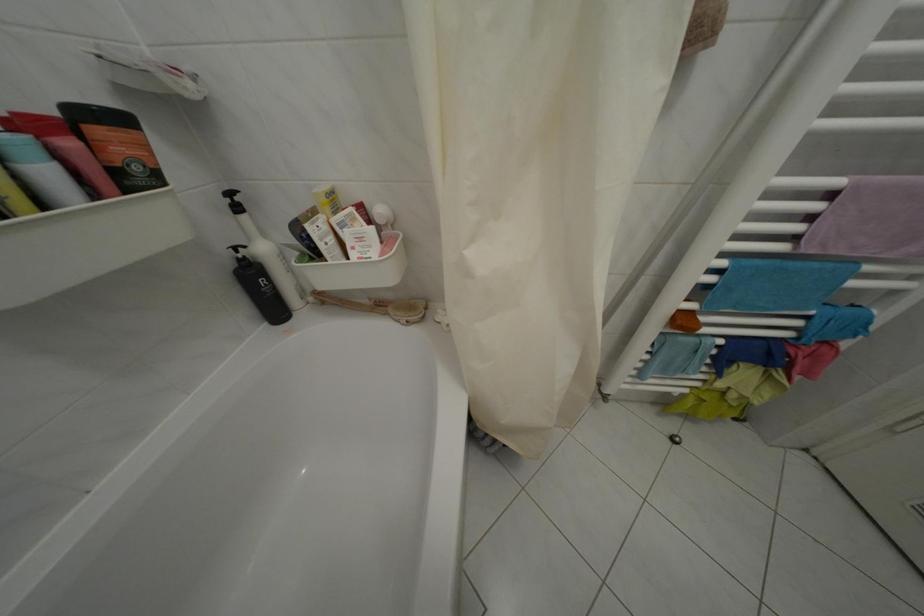
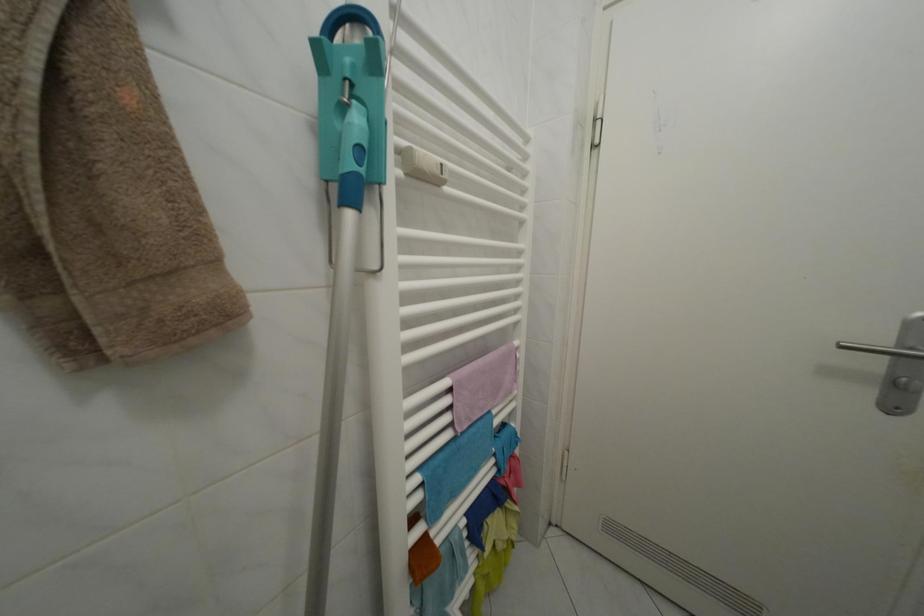
Question: I am providing you with two images of the same scene from different viewpoints. Please identify which objects are invisible in image2.

Choices:
 (A) radiator thermostat
 (B) mop handle
 (C) mop head button
 (D) none of these

Answer: (D)